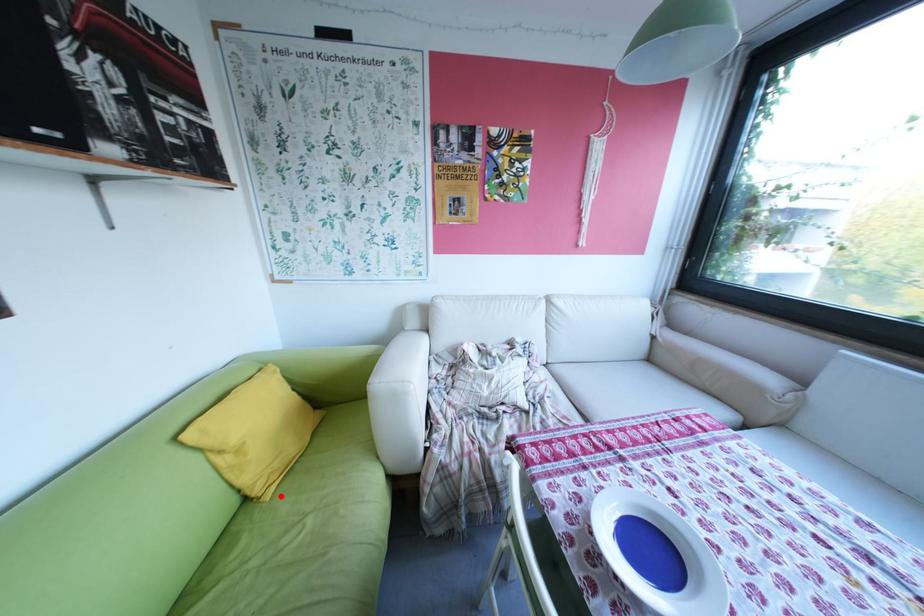
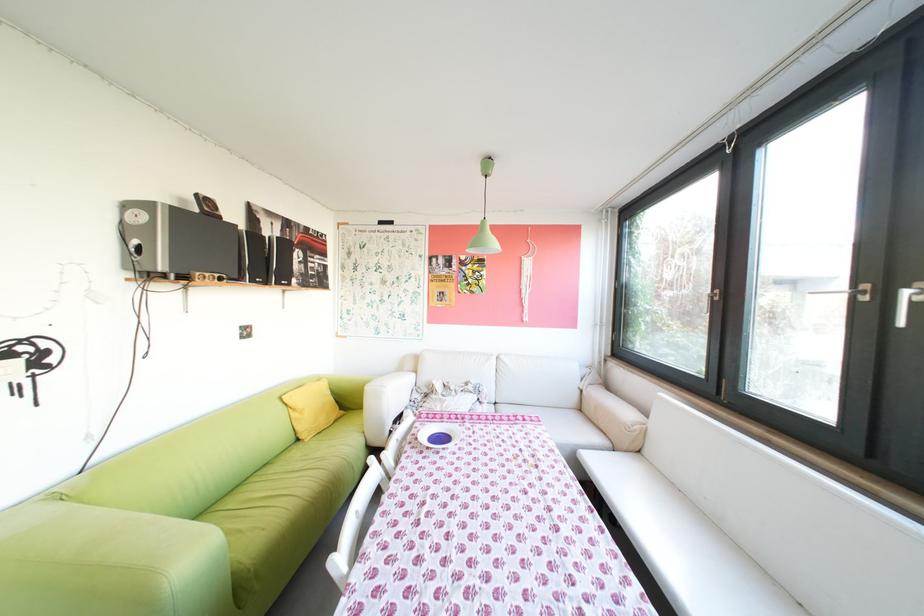
Locate, in the second image, the point that corresponds to the highlighted location in the first image.

(321, 440)